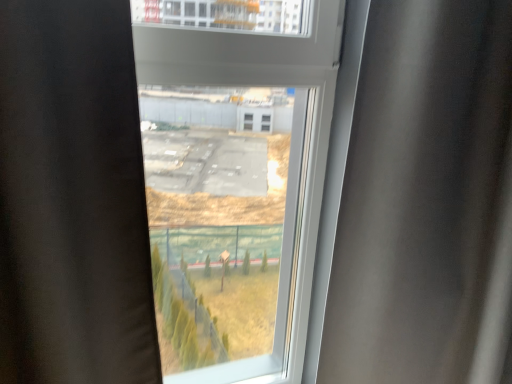
This screenshot has width=512, height=384. What do you see at coordinates (234, 177) in the screenshot? I see `transparent glass window at center` at bounding box center [234, 177].

The height and width of the screenshot is (384, 512). Find the location of `transparent glass window at center`. transparent glass window at center is located at coordinates click(x=234, y=177).

In order to click on transparent glass window at center in this screenshot , I will do `click(234, 177)`.